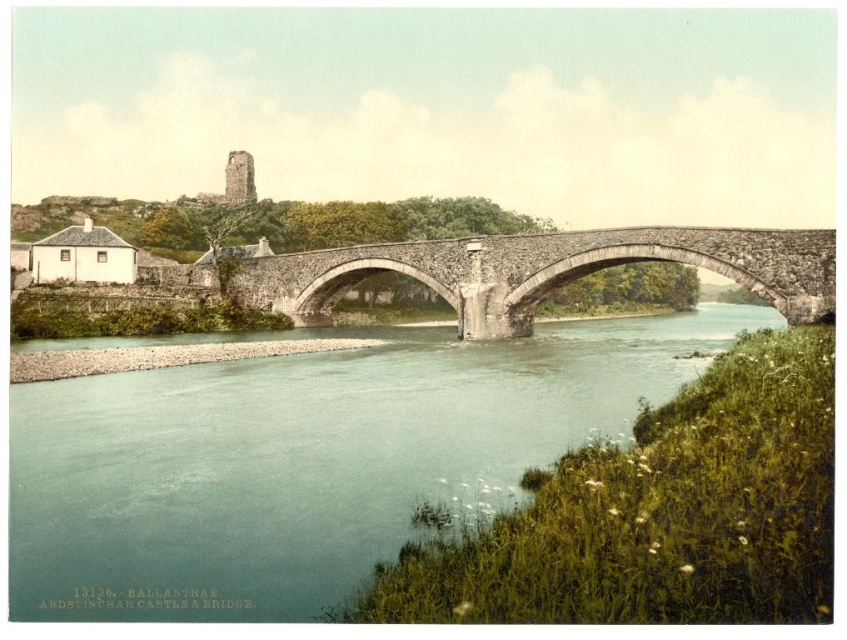
From the picture: Between clear blue water at center and stone arch bridge at center, which one has less height?

stone arch bridge at center

Who is lower down, clear blue water at center or stone arch bridge at center?

Positioned lower is clear blue water at center.

The height and width of the screenshot is (640, 847). I want to click on clear blue water at center, so click(307, 460).